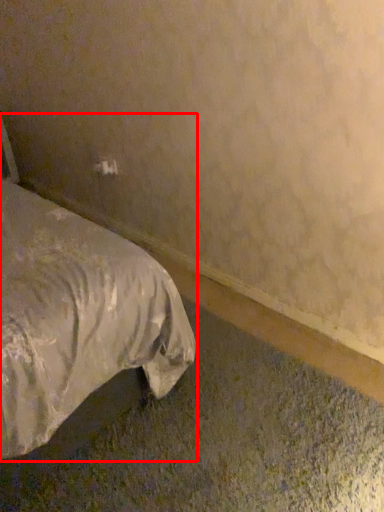
Question: From the image's perspective, where is bed (annotated by the red box) located in relation to electric outlet in the image?

Choices:
 (A) below
 (B) above

Answer: (A)